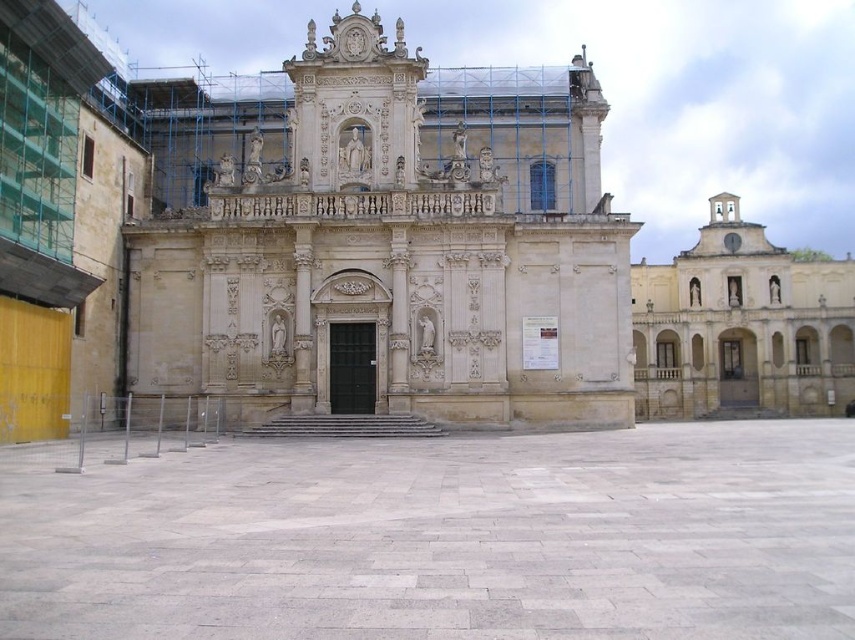
Does gray stone courtyard at center have a greater width compared to light beige stone church at upper right?

Indeed, gray stone courtyard at center has a greater width compared to light beige stone church at upper right.

Who is lower down, gray stone courtyard at center or light beige stone church at upper right?

gray stone courtyard at center

What are the coordinates of `gray stone courtyard at center` in the screenshot? It's located at (445, 538).

How much distance is there between beige stone church at center and light beige stone church at upper right?

beige stone church at center is 115.56 feet away from light beige stone church at upper right.

Describe the element at coordinates (396, 252) in the screenshot. I see `beige stone church at center` at that location.

Where is `beige stone church at center`? Image resolution: width=855 pixels, height=640 pixels. beige stone church at center is located at coordinates (396, 252).

Identify the location of beige stone church at center. The image size is (855, 640). (396, 252).

Between gray stone courtyard at center and beige stone church at center, which one has more height?

Standing taller between the two is beige stone church at center.

Can you confirm if gray stone courtyard at center is taller than beige stone church at center?

No.

Image resolution: width=855 pixels, height=640 pixels. I want to click on gray stone courtyard at center, so click(x=445, y=538).

Image resolution: width=855 pixels, height=640 pixels. What are the coordinates of `gray stone courtyard at center` in the screenshot? It's located at (445, 538).